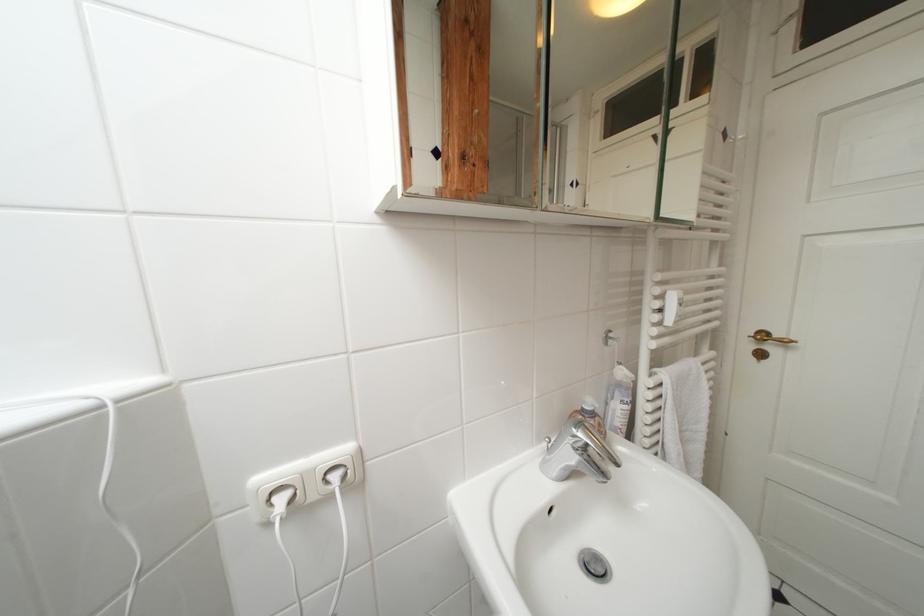
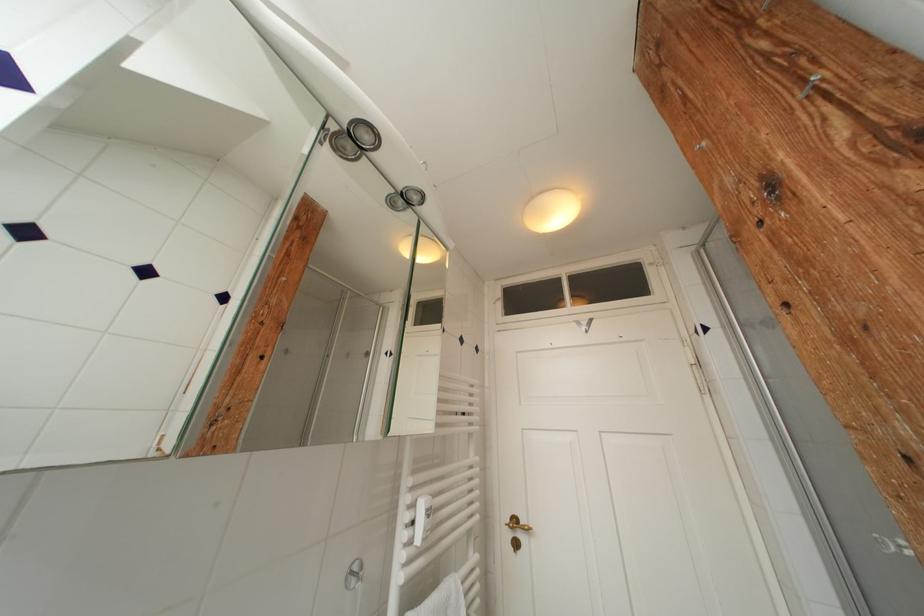
Find the pixel in the second image that matches point 769,339 in the first image.

(521, 525)